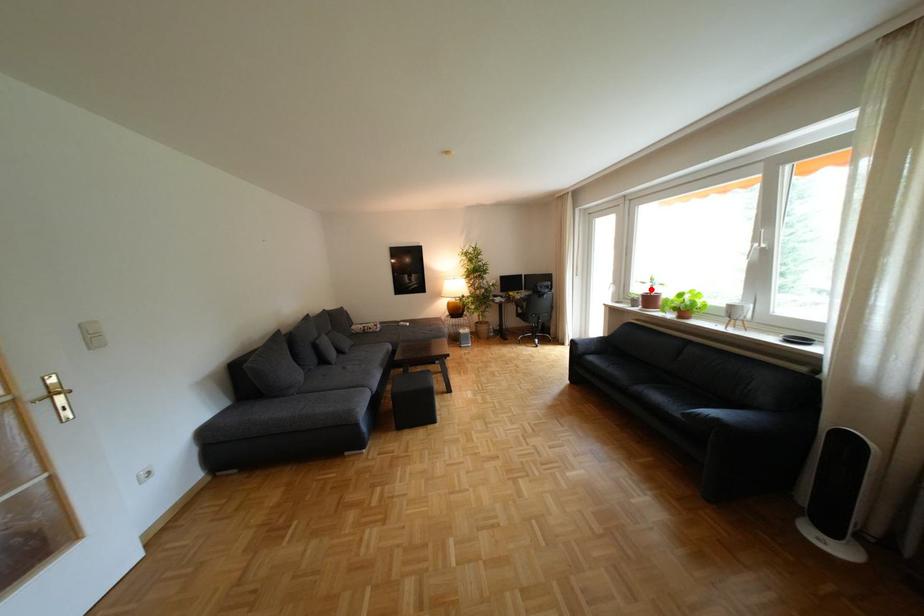
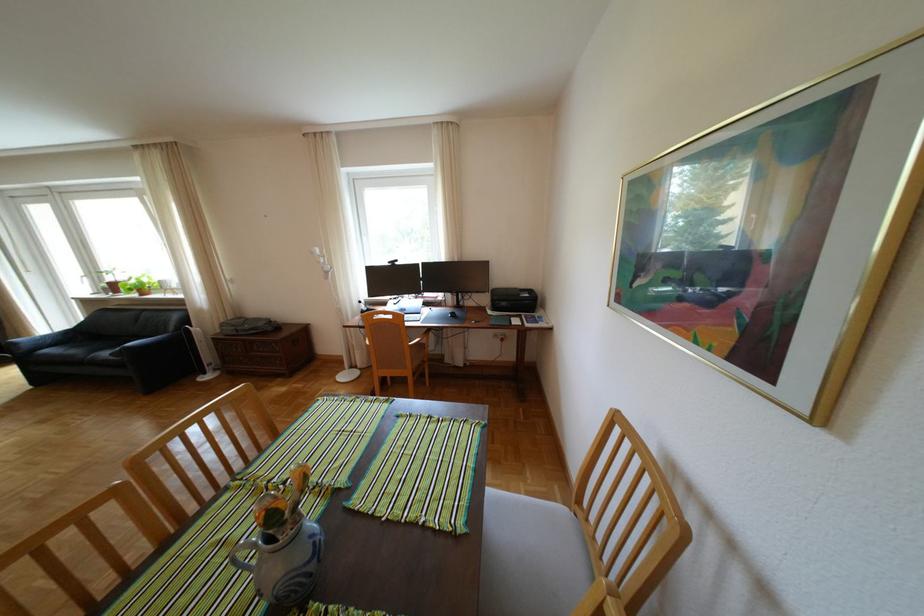
Question: I am providing you with two images of the same scene from different viewpoints. Image1 has a red point marked. In image2, the corresponding 3D location appears at what relative position? Reply with the corresponding letter.

Choices:
 (A) Closer
 (B) Farther

Answer: (B)